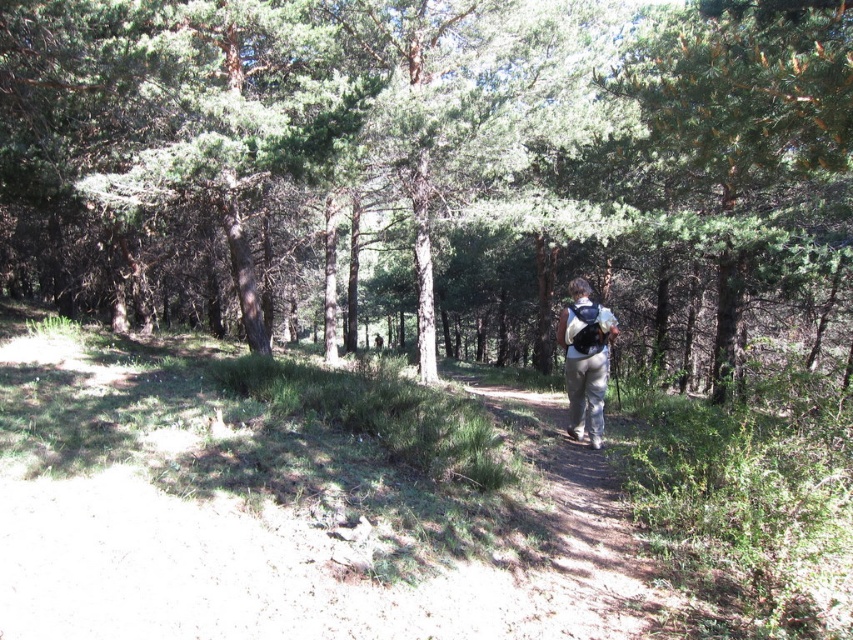
Question: Does green needle-like leaves at upper right lie behind light gray fabric backpack at center?

Choices:
 (A) yes
 (B) no

Answer: (B)

Question: Among these objects, which one is farthest from the camera?

Choices:
 (A) light gray fabric backpack at center
 (B) green leafy tree at center

Answer: (A)

Question: Does green needle-like leaves at upper right have a greater width compared to light gray fabric backpack at center?

Choices:
 (A) yes
 (B) no

Answer: (A)

Question: Which point is closer to the camera?

Choices:
 (A) (838, 132)
 (B) (375, 136)

Answer: (A)

Question: Which point is closer to the camera?

Choices:
 (A) green needle-like leaves at upper right
 (B) light gray fabric backpack at center
 (C) green leafy tree at center

Answer: (A)

Question: Can you confirm if green needle-like leaves at upper right is wider than light gray fabric backpack at center?

Choices:
 (A) yes
 (B) no

Answer: (A)